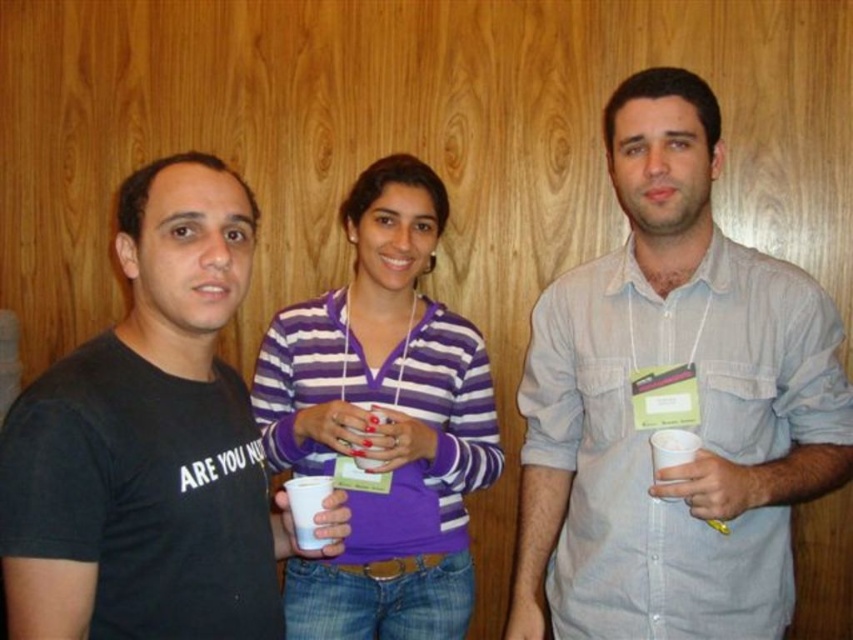
Is light blue shirt at center further to the viewer compared to black cotton t-shirt at left?

Yes, light blue shirt at center is behind black cotton t-shirt at left.

Can you confirm if light blue shirt at center is positioned above black cotton t-shirt at left?

Indeed, light blue shirt at center is positioned over black cotton t-shirt at left.

Who is more forward, (x=625, y=113) or (x=109, y=356)?

Point (x=109, y=356) is more forward.

This screenshot has height=640, width=853. What are the coordinates of `light blue shirt at center` in the screenshot? It's located at (692, 387).

Is purple striped sweater at center positioned before white paper cup at center?

No.

Between point (473, 433) and point (305, 500), which one is positioned behind?

The point (473, 433) is more distant.

I want to click on purple striped sweater at center, so click(384, 420).

Can you confirm if light blue shirt at center is taller than purple striped sweater at center?

Incorrect, light blue shirt at center's height is not larger of purple striped sweater at center's.

Can you confirm if light blue shirt at center is positioned to the left of purple striped sweater at center?

No, light blue shirt at center is not to the left of purple striped sweater at center.

Which is in front, point (664, 534) or point (437, 340)?

Point (664, 534)

Locate an element on the screen. Image resolution: width=853 pixels, height=640 pixels. light blue shirt at center is located at coordinates (692, 387).